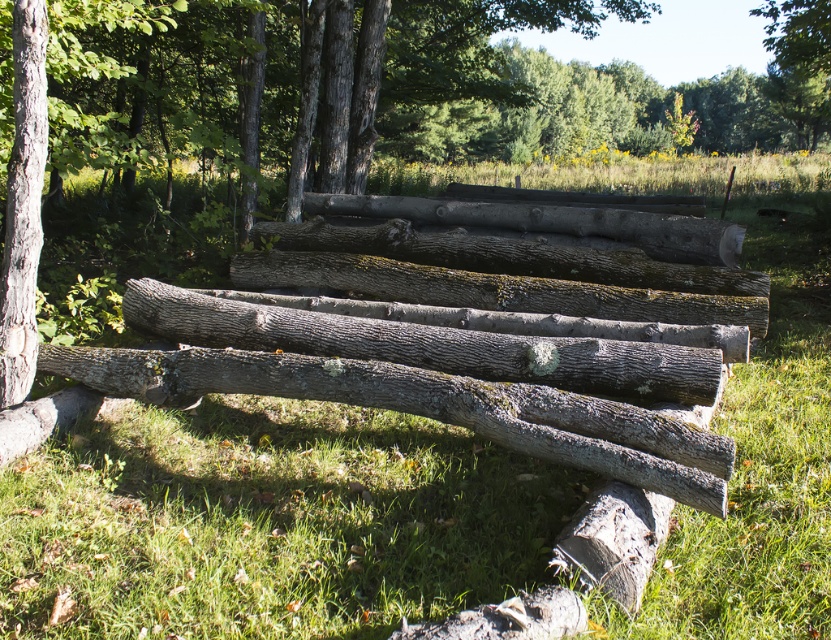
Question: Which object is closer to the camera taking this photo?

Choices:
 (A) smooth brown tree trunk at left
 (B) gray rough wood log at center
 (C) smooth bark logs at center

Answer: (A)

Question: Is smooth bark logs at center positioned before smooth brown tree trunk at left?

Choices:
 (A) yes
 (B) no

Answer: (B)

Question: Considering the relative positions of smooth brown tree trunk at left and gray rough wood log at center in the image provided, where is smooth brown tree trunk at left located with respect to gray rough wood log at center?

Choices:
 (A) below
 (B) above

Answer: (A)

Question: Which object is the farthest from the gray rough wood log at center?

Choices:
 (A) smooth bark logs at center
 (B) smooth brown tree trunk at left

Answer: (A)

Question: Which is farther from the smooth brown tree trunk at left?

Choices:
 (A) gray rough wood log at center
 (B) smooth bark logs at center

Answer: (B)

Question: Can you confirm if smooth brown tree trunk at left is thinner than gray rough wood log at center?

Choices:
 (A) yes
 (B) no

Answer: (A)